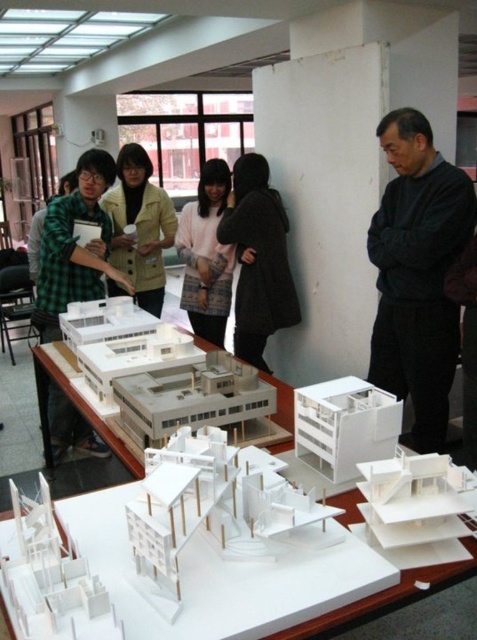
Consider the image. Does green checkered shirt at left have a smaller size compared to white paper model at center?

Correct, green checkered shirt at left occupies less space than white paper model at center.

Does point (93, 164) lie in front of point (356, 493)?

No, it is not.

Find the location of a particular element. green checkered shirt at left is located at coordinates (75, 244).

Is black sweater at right bigger than pink fabric jacket at center?

→ No, black sweater at right is not bigger than pink fabric jacket at center.

Can you confirm if black sweater at right is positioned to the right of pink fabric jacket at center?

Correct, you'll find black sweater at right to the right of pink fabric jacket at center.

Which is behind, point (449, 243) or point (209, 292)?

Point (209, 292)

Locate an element on the screen. Image resolution: width=477 pixels, height=640 pixels. black sweater at right is located at coordinates (417, 273).

Does point (82, 445) come in front of point (209, 332)?

Yes, it is.

Is green checkered shirt at left below pink fabric jacket at center?

Correct, green checkered shirt at left is located below pink fabric jacket at center.

Which is in front, point (56, 442) or point (208, 211)?

Point (56, 442) is in front.

The image size is (477, 640). In order to click on green checkered shirt at left in this screenshot , I will do `click(75, 244)`.